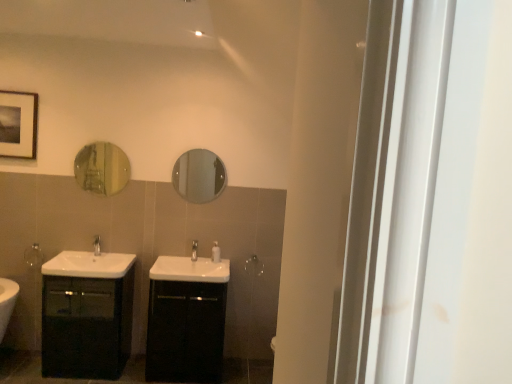
Question: Is silver metallic tap at center, which is the first tap in left-to-right order, in contact with black glossy cabinet at center, which is the second bathroom cabinet from left to right?

Choices:
 (A) no
 (B) yes

Answer: (A)

Question: Does silver metallic tap at center, which is the 2th tap from right to left, appear on the left side of black glossy cabinet at center, which is the second bathroom cabinet from left to right?

Choices:
 (A) no
 (B) yes

Answer: (B)

Question: Is silver metallic tap at center, which is the first tap in left-to-right order, outside of black glossy cabinet at center, the first bathroom cabinet from the right?

Choices:
 (A) yes
 (B) no

Answer: (A)

Question: From a real-world perspective, is silver metallic tap at center, which is the first tap in left-to-right order, over black glossy cabinet at center, the first bathroom cabinet from the right?

Choices:
 (A) yes
 (B) no

Answer: (A)

Question: Could black glossy cabinet at center, which is the second bathroom cabinet from left to right, be considered to be inside silver metallic tap at center, which is the first tap in left-to-right order?

Choices:
 (A) no
 (B) yes

Answer: (A)

Question: Does silver metallic tap at center, which is the first tap in left-to-right order, have a greater height compared to black glossy cabinet at center, which is the second bathroom cabinet from left to right?

Choices:
 (A) yes
 (B) no

Answer: (B)

Question: From a real-world perspective, is white glossy sink at lower left, placed as the 2th sink when sorted from right to left, under white glossy soap dispenser at center?

Choices:
 (A) yes
 (B) no

Answer: (A)

Question: Is white glossy sink at lower left, placed as the 2th sink when sorted from right to left, located outside white glossy soap dispenser at center?

Choices:
 (A) no
 (B) yes

Answer: (B)

Question: From the image's perspective, is white glossy sink at lower left, placed as the 2th sink when sorted from right to left, on top of white glossy soap dispenser at center?

Choices:
 (A) no
 (B) yes

Answer: (A)

Question: From a real-world perspective, is white glossy sink at lower left, arranged as the first sink when viewed from the left, physically above white glossy soap dispenser at center?

Choices:
 (A) no
 (B) yes

Answer: (A)

Question: Is white glossy sink at lower left, arranged as the first sink when viewed from the left, positioned far away from white glossy soap dispenser at center?

Choices:
 (A) yes
 (B) no

Answer: (B)

Question: Does white glossy sink at lower left, placed as the 2th sink when sorted from right to left, have a greater width compared to white glossy soap dispenser at center?

Choices:
 (A) yes
 (B) no

Answer: (A)

Question: From a real-world perspective, is silver metallic towel bar at left, the second towel bar viewed from the right, on top of satin nickel faucet at center, which ranks as the 2th tap in left-to-right order?

Choices:
 (A) no
 (B) yes

Answer: (A)